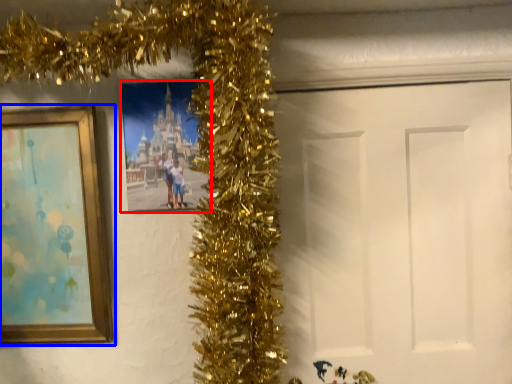
Question: Which object appears farthest to the camera in this image, picture frame (highlighted by a red box) or picture frame (highlighted by a blue box)?

Choices:
 (A) picture frame
 (B) picture frame

Answer: (A)